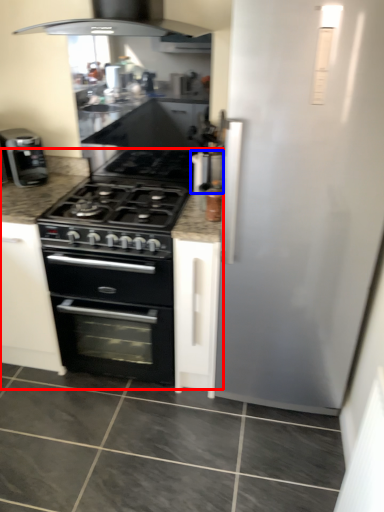
Question: Among these objects, which one is nearest to the camera, counter (highlighted by a red box) or appliance (highlighted by a blue box)?

Choices:
 (A) counter
 (B) appliance

Answer: (A)